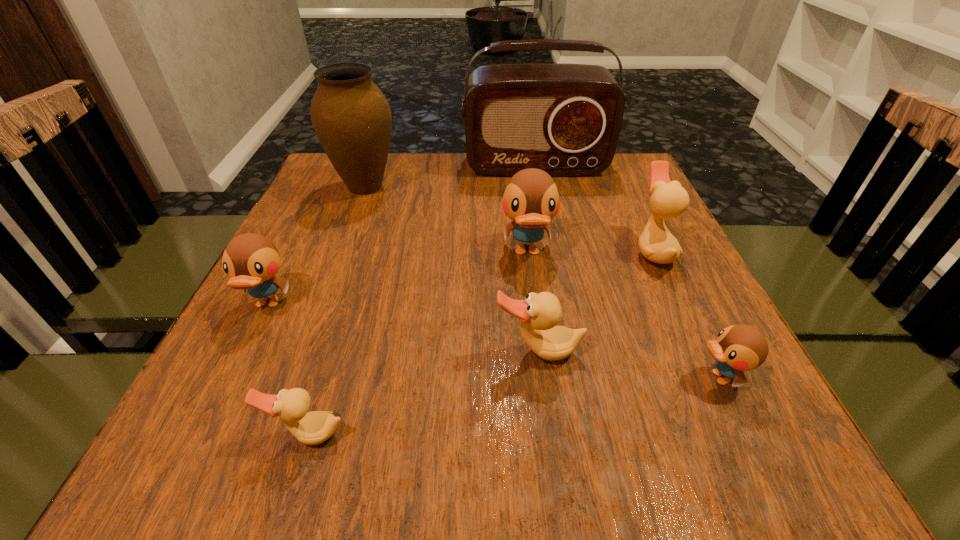
Where is `the rightmost blue duck`? The width and height of the screenshot is (960, 540). the rightmost blue duck is located at coordinates (738, 348).

The width and height of the screenshot is (960, 540). In order to click on the nearest blue duck in this screenshot , I will do `click(738, 348)`.

What are the coordinates of `the nearest object` in the screenshot? It's located at (311, 428).

This screenshot has width=960, height=540. What are the coordinates of `the nearest duck` in the screenshot? It's located at (311, 428).

Where is `vacant space located 0.380m on the front panel of the radio receiver`? This screenshot has width=960, height=540. vacant space located 0.380m on the front panel of the radio receiver is located at coordinates (557, 275).

Find the location of a particular element. Image resolution: width=960 pixels, height=540 pixels. free space located 0.080m on the right of the urn is located at coordinates (432, 187).

Locate an element on the screen. The height and width of the screenshot is (540, 960). vacant space located 0.220m on the front-facing side of the second blue duck from right to left is located at coordinates (541, 365).

The width and height of the screenshot is (960, 540). What are the coordinates of `vacant region located on the beak of the biggest tan duck` in the screenshot? It's located at (515, 251).

Where is `vacant position located on the beak of the biggest tan duck`? vacant position located on the beak of the biggest tan duck is located at coordinates 539,251.

Identify the location of vacant space located on the beak of the biggest tan duck. Image resolution: width=960 pixels, height=540 pixels. (563, 251).